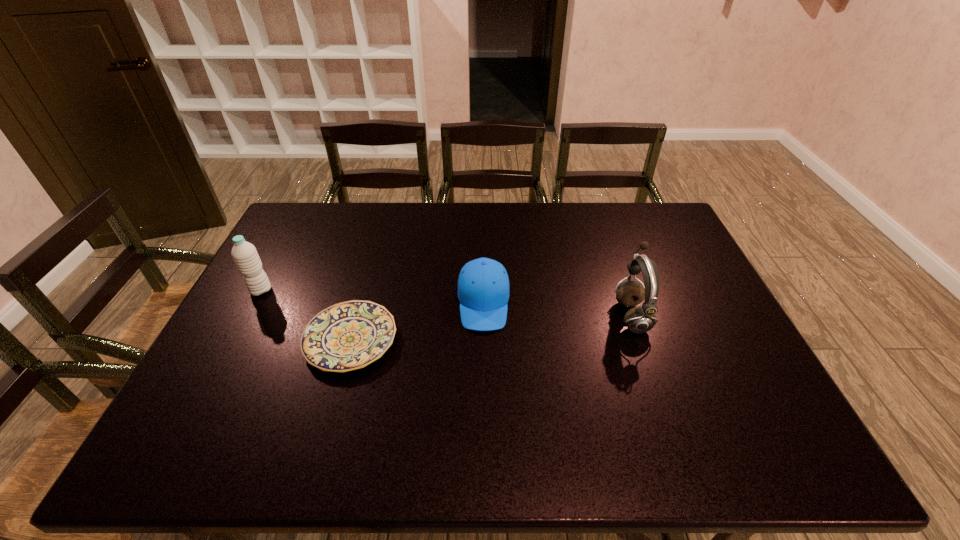
I want to click on empty location between the second object from right to left and the rightmost object, so click(x=558, y=309).

At what (x,y) coordinates should I click in order to perform the action: click on free space between the third object from right to left and the leftmost object. Please return your answer as a coordinate pair (x, y). The image size is (960, 540). Looking at the image, I should click on (305, 315).

Find the location of `free area in between the third object from left to right and the water bottle`. free area in between the third object from left to right and the water bottle is located at coordinates (372, 296).

Where is `free space between the leftmost object and the rightmost object`? free space between the leftmost object and the rightmost object is located at coordinates (446, 303).

The height and width of the screenshot is (540, 960). I want to click on vacant area between the shortest object and the leftmost object, so click(x=305, y=315).

I want to click on vacant space that's between the shortest object and the cap, so click(x=417, y=321).

Identify the location of object identified as the second closest to the third object from left to right. (641, 319).

This screenshot has width=960, height=540. What are the coordinates of `object that is the closest to the shortest object` in the screenshot? It's located at (483, 286).